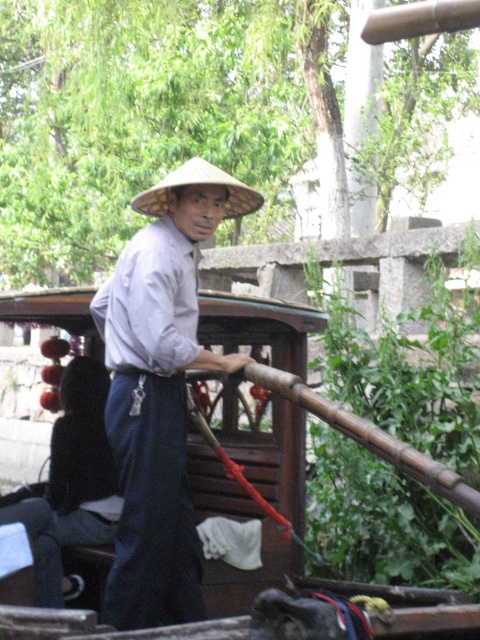
Is point (168, 218) in front of point (275, 480)?

That is True.

Consider the image. Which of these two, light gray cotton shirt at center or wooden boat at center, stands taller?

Standing taller between the two is light gray cotton shirt at center.

I want to click on light gray cotton shirt at center, so click(159, 392).

Find the location of a particular element. The width and height of the screenshot is (480, 640). light gray cotton shirt at center is located at coordinates (159, 392).

Is point (467, 616) more distant than point (216, 182)?

No.

Is wooden boat at center to the left of natural straw hat at center from the viewer's perspective?

Incorrect, wooden boat at center is not on the left side of natural straw hat at center.

In order to click on wooden boat at center in this screenshot , I will do coord(300,404).

At what (x,y) coordinates should I click in order to perform the action: click on wooden boat at center. Please return your answer as a coordinate pair (x, y). Looking at the image, I should click on (300, 404).

Can you confirm if light gray cotton shirt at center is positioned to the left of natural straw hat at center?

Correct, you'll find light gray cotton shirt at center to the left of natural straw hat at center.

Is point (167, 394) less distant than point (259, 196)?

Yes, point (167, 394) is in front of point (259, 196).

You are a GUI agent. You are given a task and a screenshot of the screen. Output one action in this format:
    pyautogui.click(x=<x>, y=<y>)
    Task: Click on the light gray cotton shirt at center
    The height and width of the screenshot is (640, 480).
    Given the screenshot: What is the action you would take?
    pyautogui.click(x=159, y=392)